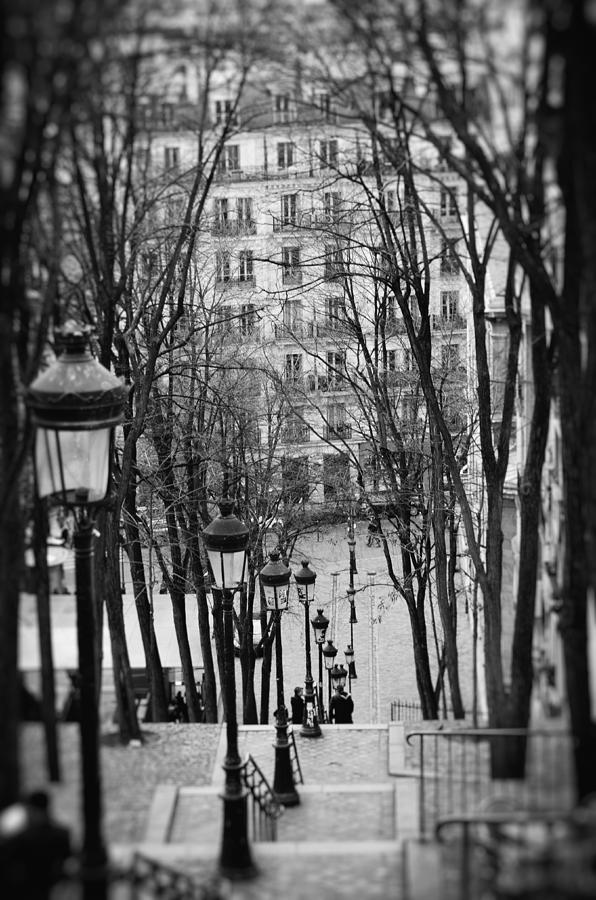
Where is `stairs railing`? stairs railing is located at coordinates (173, 876), (269, 798), (297, 747).